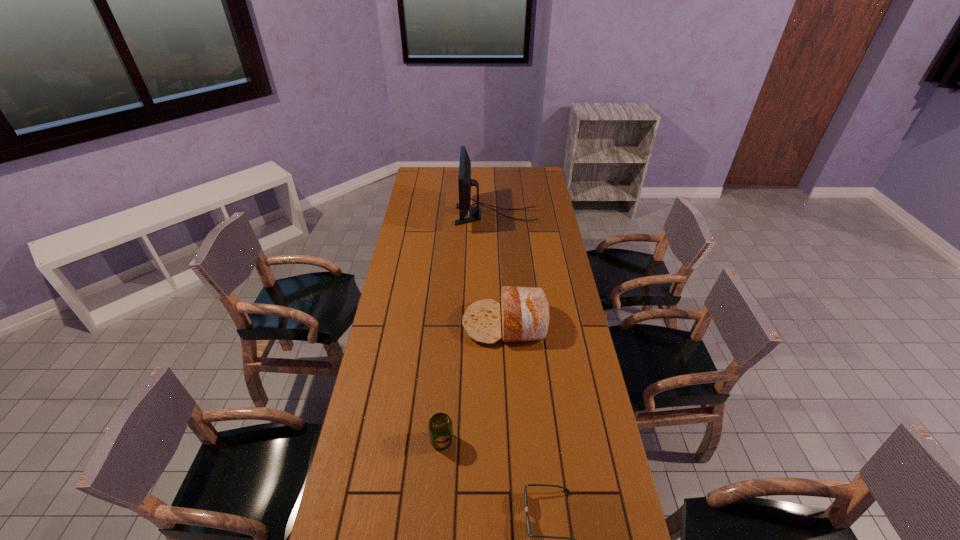
Locate an element on the screen. free region located 0.120m at the sliced end of the second tallest object is located at coordinates (432, 324).

This screenshot has height=540, width=960. What are the coordinates of `vacant space situated 0.200m at the sliced end of the second tallest object` in the screenshot? It's located at (411, 324).

You are a GUI agent. You are given a task and a screenshot of the screen. Output one action in this format:
    pyautogui.click(x=<x>, y=<y>)
    Task: Click on the vacant region located 0.270m on the back of the third farthest object
    The image size is (960, 540).
    Given the screenshot: What is the action you would take?
    pyautogui.click(x=447, y=361)

This screenshot has height=540, width=960. In order to click on computer monitor positioned at the right edge in this screenshot , I will do `click(465, 182)`.

The image size is (960, 540). I want to click on bread positioned at the right edge, so click(525, 312).

The width and height of the screenshot is (960, 540). I want to click on free region at the far edge of the desktop, so click(447, 171).

In the image, there is a desktop. Where is `vacant space at the left edge`? vacant space at the left edge is located at coordinates [414, 190].

This screenshot has width=960, height=540. In order to click on vacant space at the right edge of the desktop in this screenshot , I will do pos(586,367).

Identify the location of free space at the far right corner. (528, 168).

The image size is (960, 540). What are the coordinates of `vacant space in between the beer can and the second farthest object` in the screenshot? It's located at (473, 382).